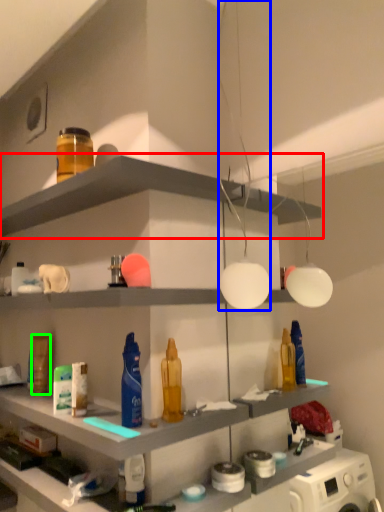
Question: Considering the real-world distances, which object is closest to shelf (highlighted by a red box)? light fixture (highlighted by a blue box) or toiletry (highlighted by a green box).

Choices:
 (A) light fixture
 (B) toiletry

Answer: (A)